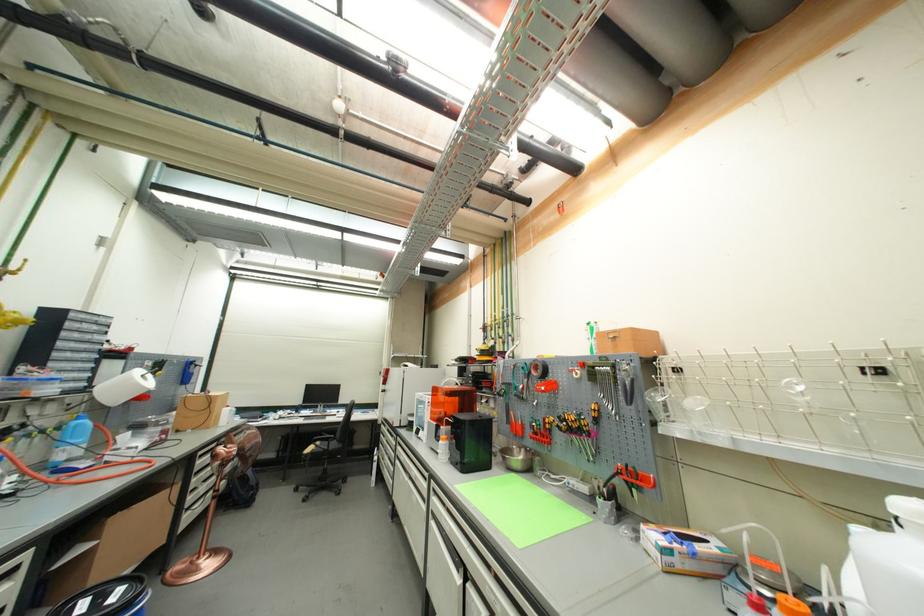
Image resolution: width=924 pixels, height=616 pixels. Identify the location of paper towel roll. (123, 387).